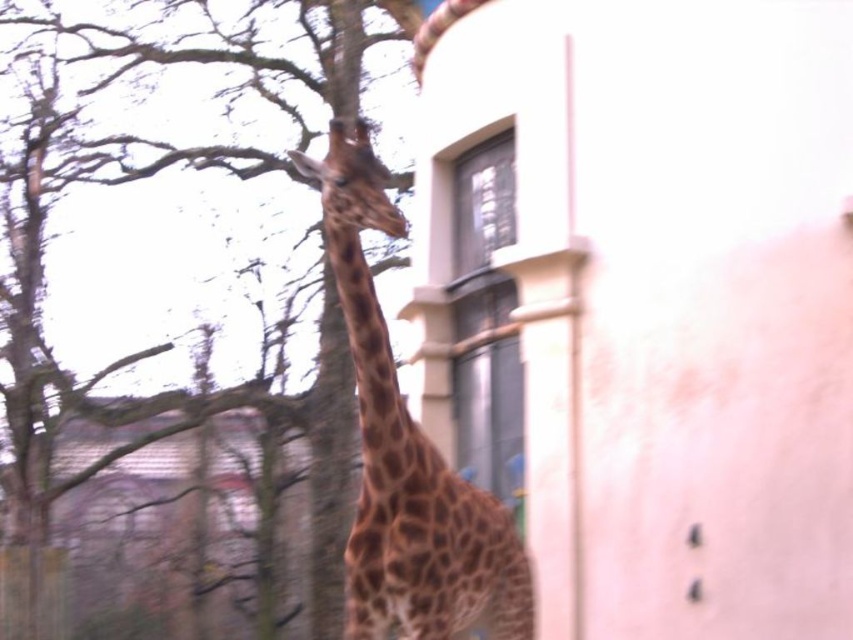
Question: Is brown textured tree at upper left below brown spotted giraffe at center?

Choices:
 (A) yes
 (B) no

Answer: (B)

Question: Observing the image, what is the correct spatial positioning of brown textured tree at upper left in reference to brown spotted giraffe at center?

Choices:
 (A) right
 (B) left

Answer: (B)

Question: Among these objects, which one is farthest from the camera?

Choices:
 (A) brown spotted giraffe at center
 (B) brown textured tree at upper left

Answer: (B)

Question: Can you confirm if brown textured tree at upper left is positioned below brown spotted giraffe at center?

Choices:
 (A) no
 (B) yes

Answer: (A)

Question: Among these objects, which one is farthest from the camera?

Choices:
 (A) brown spotted giraffe at center
 (B) brown textured tree at upper left

Answer: (B)